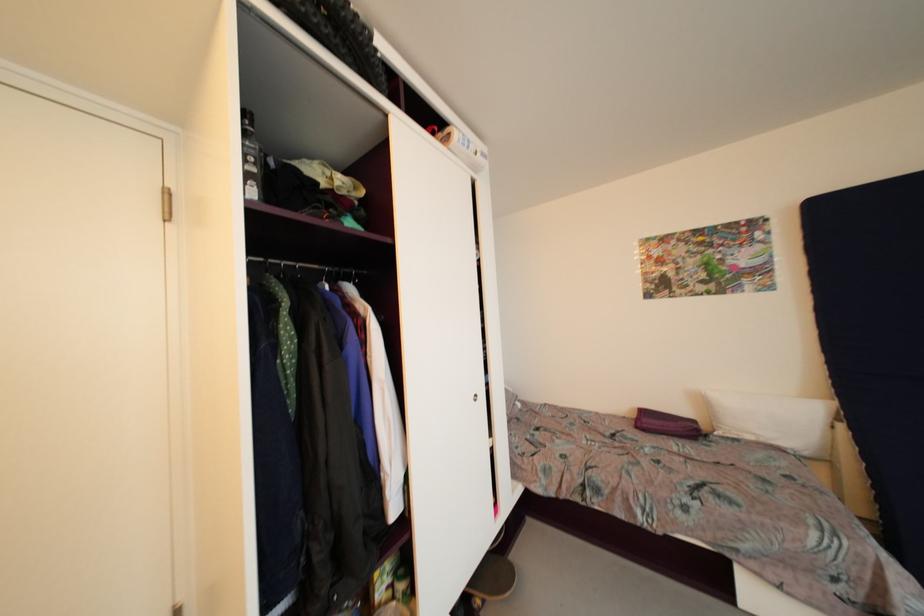
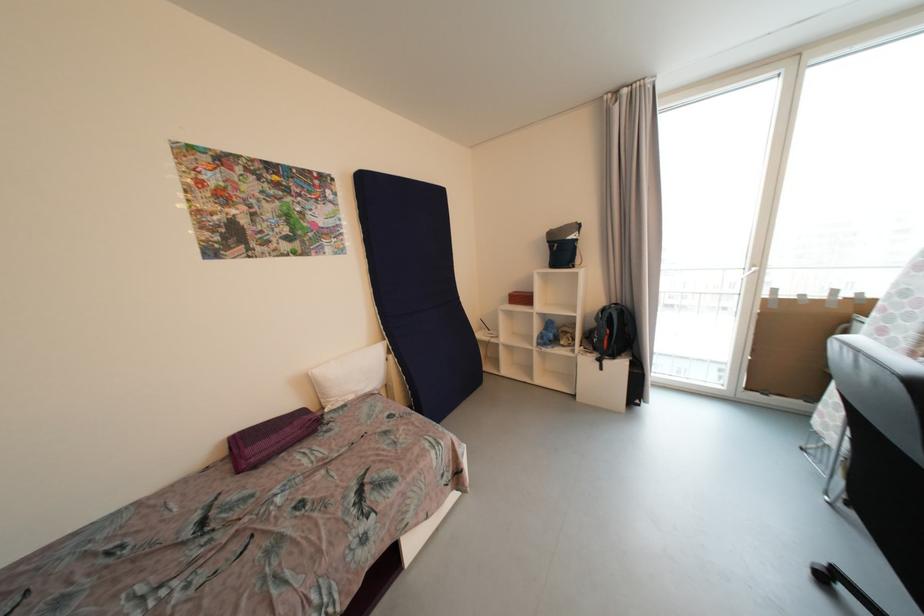
The point at (x=847, y=428) is marked in the first image. Where is the corresponding point in the second image?

(396, 359)